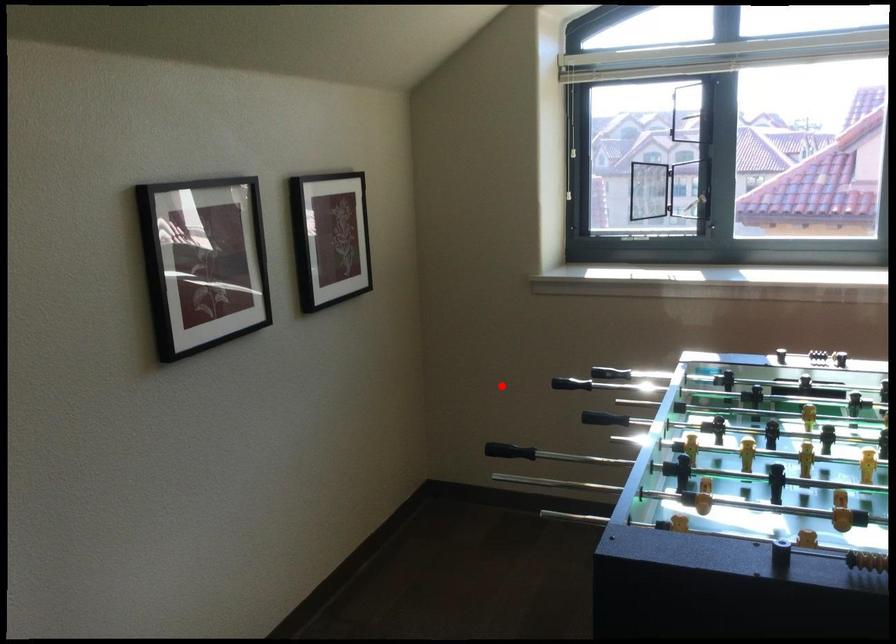
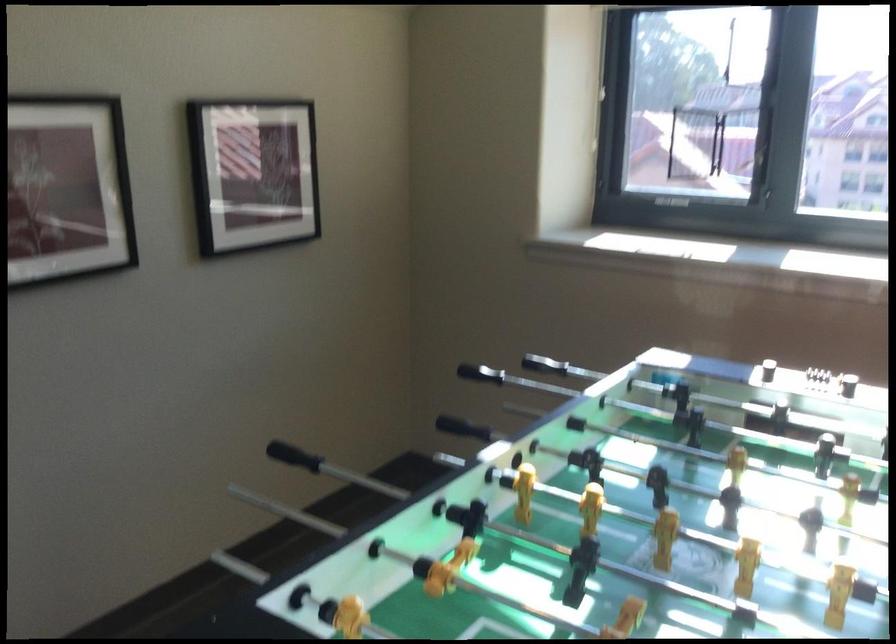
Question: I am providing you with two images of the same scene from different viewpoints. In image1, a red point is highlighted. Considering the same 3D point in image2, which of the following is correct?

Choices:
 (A) It is closer
 (B) It is farther

Answer: (A)